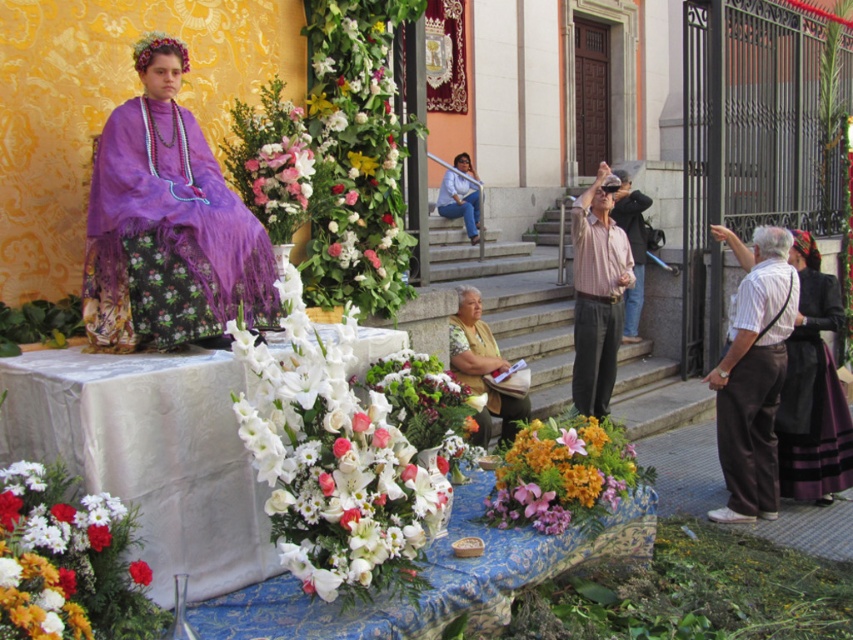
Is brown cotton pants at right wider than floral-patterned fabric at center?

No.

Who is shorter, brown cotton pants at right or floral-patterned fabric at center?

Standing shorter between the two is floral-patterned fabric at center.

What do you see at coordinates (753, 385) in the screenshot? I see `brown cotton pants at right` at bounding box center [753, 385].

Where is `brown cotton pants at right`? The image size is (853, 640). brown cotton pants at right is located at coordinates (753, 385).

In the scene shown: Between brown cotton pants at right and white matte flower at center, which one is positioned lower?

Positioned lower is white matte flower at center.

Which is in front, point (759, 392) or point (144, 584)?

Point (144, 584)

What are the coordinates of `brown cotton pants at right` in the screenshot? It's located at (753, 385).

Who is positioned more to the right, velvet purple dress at lower right or blue denim jeans at center?

velvet purple dress at lower right is more to the right.

Does velvet purple dress at lower right have a lesser width compared to blue denim jeans at center?

Yes, velvet purple dress at lower right is thinner than blue denim jeans at center.

Locate an element on the screen. Image resolution: width=853 pixels, height=640 pixels. velvet purple dress at lower right is located at coordinates (813, 400).